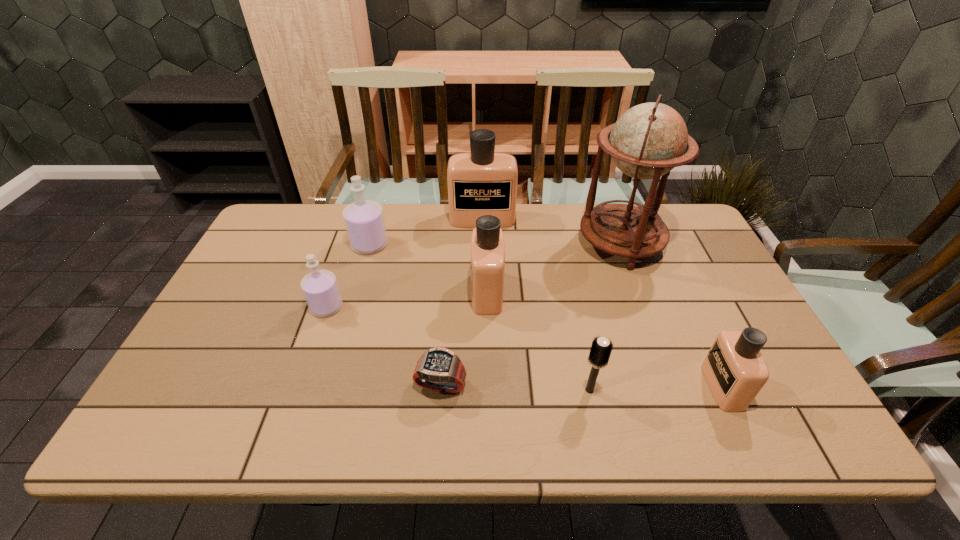
What are the coordinates of `the tallest object` in the screenshot? It's located at (650, 139).

Identify the location of the biggest beige perfume. (482, 182).

Identify the location of the farthest perfume. (482, 182).

This screenshot has height=540, width=960. I want to click on the second smallest beige perfume, so click(487, 241).

At what (x,y) coordinates should I click in order to perform the action: click on the farther purple perfume. Please return your answer as a coordinate pair (x, y). The image size is (960, 540). Looking at the image, I should click on (364, 220).

The image size is (960, 540). Identify the location of the fourth nearest perfume. point(364,220).

Image resolution: width=960 pixels, height=540 pixels. I want to click on the nearer purple perfume, so click(x=320, y=288).

At what (x,y) coordinates should I click in order to perform the action: click on the rightmost perfume. Please return your answer as a coordinate pair (x, y). The image size is (960, 540). Looking at the image, I should click on pos(735,371).

The image size is (960, 540). I want to click on the nearest perfume, so click(735, 371).

At what (x,y) coordinates should I click in order to perform the action: click on the third object from right to left. Please return your answer as a coordinate pair (x, y). Looking at the image, I should click on (601, 348).